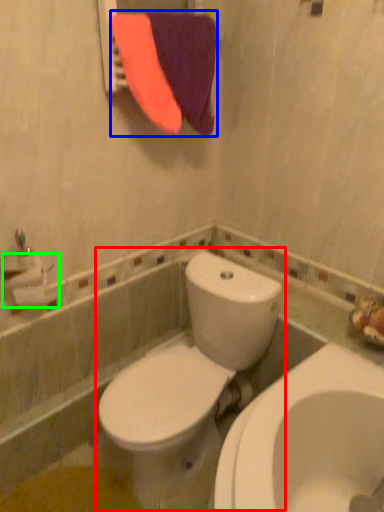
Question: Which is nearer to the toilet (highlighted by a red box)? beach towel (highlighted by a blue box) or toilet paper (highlighted by a green box).

Choices:
 (A) beach towel
 (B) toilet paper

Answer: (B)